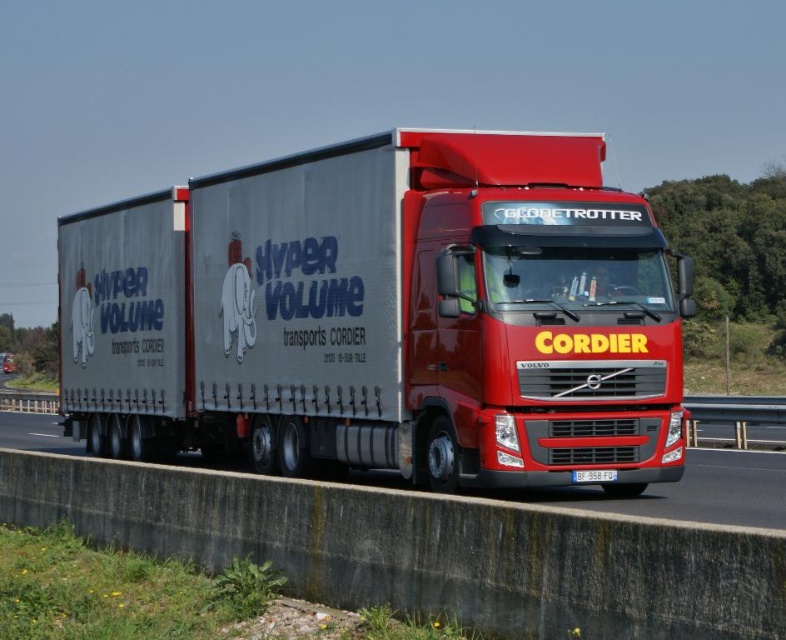
Question: Among these points, which one is farthest from the camera?

Choices:
 (A) (592, 472)
 (B) (744, 492)
 (C) (120, 396)

Answer: (C)

Question: Is metallic silver trailer at center below blue metallic license plate at center?

Choices:
 (A) no
 (B) yes

Answer: (A)

Question: Does metallic silver trailer at center have a smaller size compared to blue metallic license plate at center?

Choices:
 (A) yes
 (B) no

Answer: (B)

Question: Can you confirm if metallic gray highway at center is smaller than blue metallic license plate at center?

Choices:
 (A) yes
 (B) no

Answer: (B)

Question: Based on their relative distances, which object is farther from the metallic gray highway at center?

Choices:
 (A) blue metallic license plate at center
 (B) metallic silver trailer at center

Answer: (A)

Question: Estimate the real-world distances between objects in this image. Which object is closer to the blue metallic license plate at center?

Choices:
 (A) metallic gray highway at center
 (B) metallic silver trailer at center

Answer: (B)